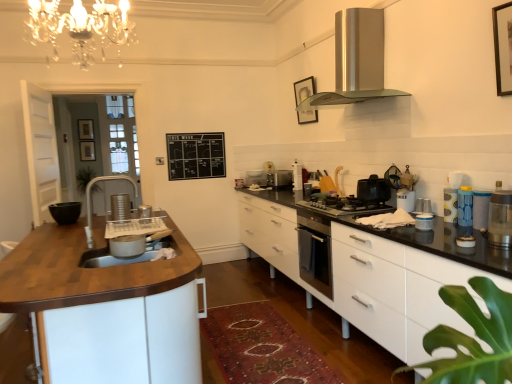
Find the location of a particular element. empty space that is to the right of satin silver toaster at left, acting as the first appliance starting from the left is located at coordinates (144, 216).